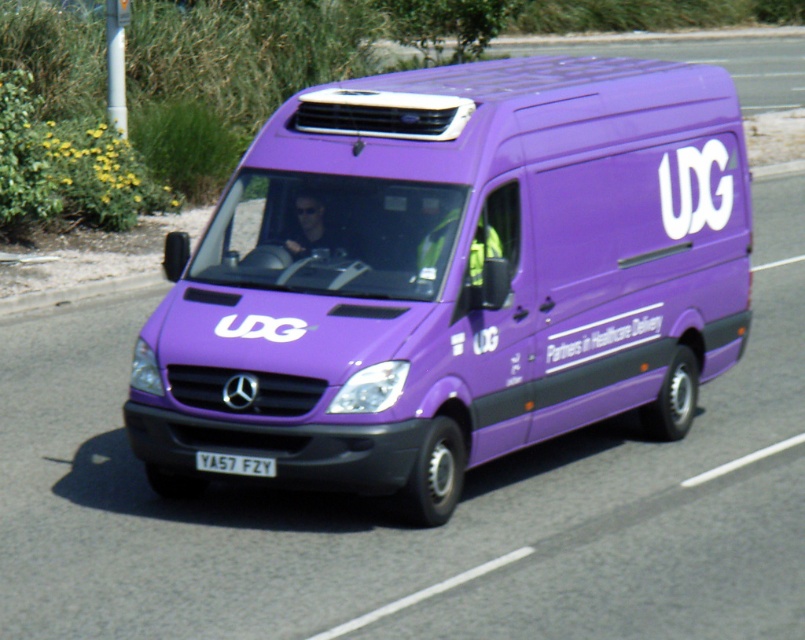
Question: Does purple matte van at center have a larger size compared to white plastic license plate at center?

Choices:
 (A) no
 (B) yes

Answer: (B)

Question: Is purple matte van at center smaller than white plastic license plate at center?

Choices:
 (A) yes
 (B) no

Answer: (B)

Question: From the image, what is the correct spatial relationship of purple matte van at center in relation to white plastic license plate at center?

Choices:
 (A) left
 (B) right

Answer: (B)

Question: Which point appears closest to the camera in this image?

Choices:
 (A) (238, 472)
 (B) (440, 284)

Answer: (A)

Question: Which of the following is the farthest from the observer?

Choices:
 (A) (519, 97)
 (B) (266, 474)

Answer: (A)